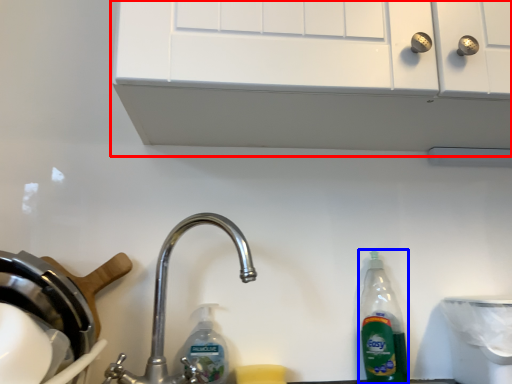
Question: Which object is closer to the camera taking this photo, vent (highlighted by a red box) or bottle (highlighted by a blue box)?

Choices:
 (A) vent
 (B) bottle

Answer: (A)